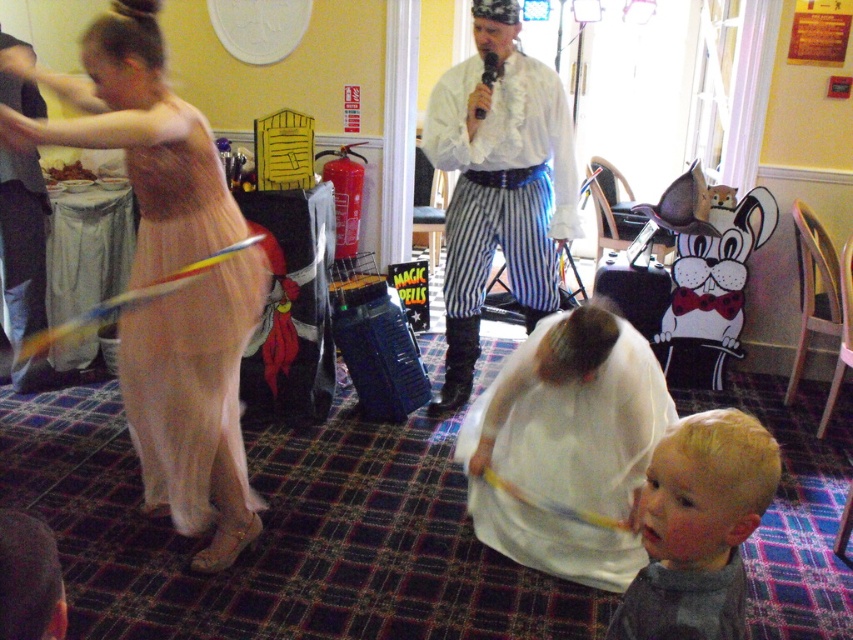
You are a photographer at the event and need to capture both the matte pink dress at left and the translucent tulle dress at left in a single frame. Which dress should you focus on first to ensure both are in the shot?

The matte pink dress at left is taller than the translucent tulle dress at left, so focus on positioning the taller matte pink dress at left first to ensure both are visible in the frame.

You are organizing a photoshoot and need to decide which outfit takes up more space in the frame. Based on the scene, which one between the white sheer dress at center and the white ruffled shirt at center is wider?

The white sheer dress at center is wider than the white ruffled shirt at center according to the description.

In the image, there is a young child observing and a woman in a flowing pale pink gown spinning a hula hoop. Where is the point located at coordinates (x=195, y=403) in relation to these two figures?

The point at coordinates (x=195, y=403) corresponds to the matte pink dress at left, which is the location of the woman in the flowing pale pink gown spinning the hula hoop.